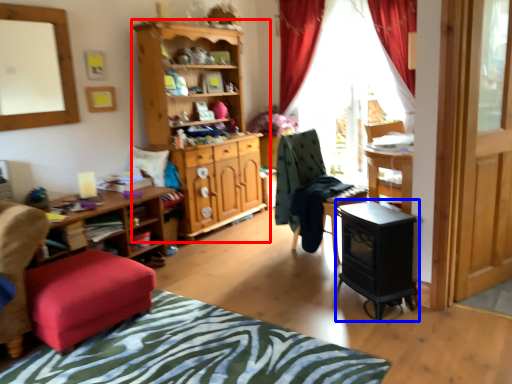
Question: Which object appears closest to the camera in this image, cabinetry (highlighted by a red box) or computer desk (highlighted by a blue box)?

Choices:
 (A) cabinetry
 (B) computer desk

Answer: (B)